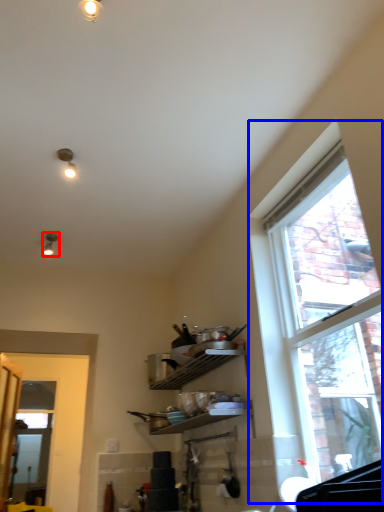
Question: Which object appears closest to the camera in this image, light fixture (highlighted by a red box) or window (highlighted by a blue box)?

Choices:
 (A) light fixture
 (B) window

Answer: (B)